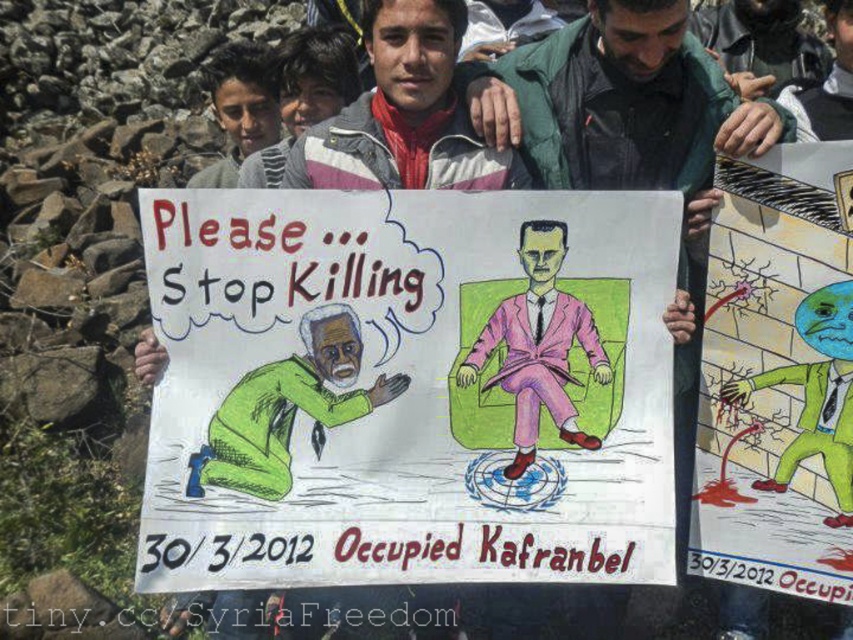
Is the position of matte paper poster at center more distant than that of pink fabric suit at center?

No, matte paper poster at center is closer to the viewer.

Identify the location of matte paper poster at center. (405, 387).

Is striped fleece jacket at center in front of green rubber glove at lower right?

Yes, it is.

Does point (337, 160) come closer to viewer compared to point (822, 340)?

No.

Image resolution: width=853 pixels, height=640 pixels. I want to click on striped fleece jacket at center, so click(404, 113).

Identify the location of striped fleece jacket at center. This screenshot has width=853, height=640. (404, 113).

Describe the element at coordinates (404, 113) in the screenshot. I see `striped fleece jacket at center` at that location.

Is point (392, 49) positioned behind point (236, 442)?

Yes, point (392, 49) is farther from viewer.

Image resolution: width=853 pixels, height=640 pixels. Identify the location of striped fleece jacket at center. (404, 113).